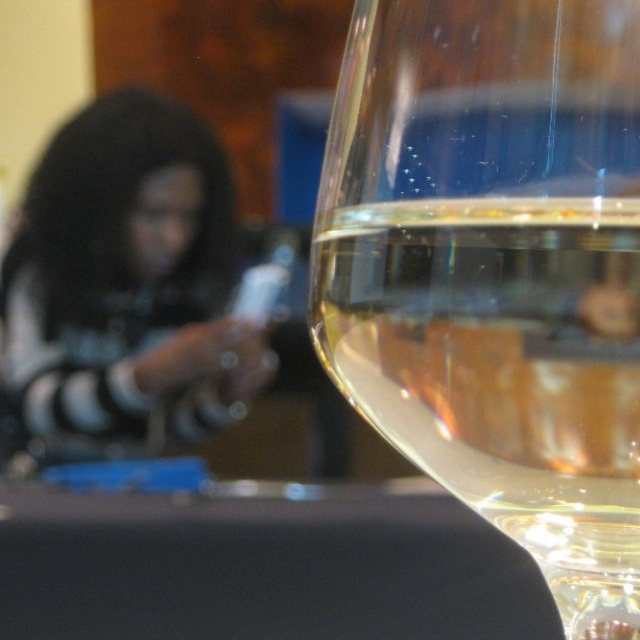
You are standing in front of the wine glass in the image. There are two points marked in the scene. Which point is closer to you, point (506, 232) or point (220, 220)?

Point (506, 232) is in front of point (220, 220), so it is closer to you.